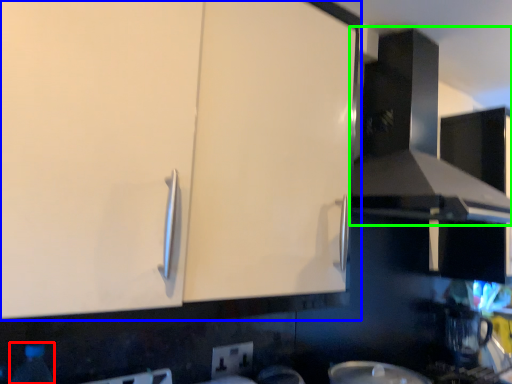
Question: Estimate the real-world distances between objects in this image. Which object is closer to bottle (highlighted by a red box), cabinetry (highlighted by a blue box) or exhaust hood (highlighted by a green box)?

Choices:
 (A) cabinetry
 (B) exhaust hood

Answer: (A)